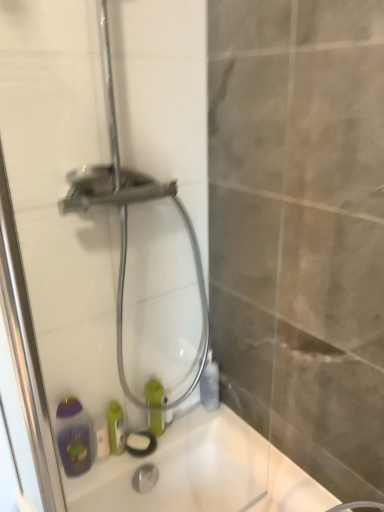
Where is `white matte soap bar at lower left`? The image size is (384, 512). white matte soap bar at lower left is located at coordinates (102, 442).

The image size is (384, 512). What do you see at coordinates (210, 384) in the screenshot?
I see `matte gray bottle at right, the second bottle when ordered from left to right` at bounding box center [210, 384].

At what (x,y) coordinates should I click in order to perform the action: click on white matte soap bar at lower left. Please return your answer as a coordinate pair (x, y). Image resolution: width=384 pixels, height=512 pixels. Looking at the image, I should click on (x=102, y=442).

Could you tell me if white matte soap bar at lower left is facing matte gray bottle at right, the first bottle viewed from the right?

No.

You are a GUI agent. You are given a task and a screenshot of the screen. Output one action in this format:
    pyautogui.click(x=<x>, y=<y>)
    Task: Click on the toiletry located on the left of matte gray bottle at right, the second bottle when ordered from left to right
    This screenshot has width=384, height=512.
    Given the screenshot: What is the action you would take?
    pyautogui.click(x=102, y=442)

From their relative heights in the image, would you say white matte soap bar at lower left is taller or shorter than matte gray bottle at right, the first bottle viewed from the right?

Considering their sizes, white matte soap bar at lower left has less height than matte gray bottle at right, the first bottle viewed from the right.

From a real-world perspective, is white matte soap bar at lower left above or below matte gray bottle at right, the second bottle when ordered from left to right?

Clearly, from a real-world perspective, white matte soap bar at lower left is below matte gray bottle at right, the second bottle when ordered from left to right.

In the scene shown: Is green matte bottle at center, which is the second bottle in right-to-left order, wider or thinner than transparent glass shower door at center?

In the image, green matte bottle at center, which is the second bottle in right-to-left order, appears to be wider than transparent glass shower door at center.

From the image's perspective, which is above, green matte bottle at center, placed as the 1th bottle when sorted from left to right, or transparent glass shower door at center?

transparent glass shower door at center is shown above in the image.

Based on their positions, is green matte bottle at center, which is the second bottle in right-to-left order, located to the left or right of transparent glass shower door at center?

From the image, it's evident that green matte bottle at center, which is the second bottle in right-to-left order, is to the left of transparent glass shower door at center.

Is point (163, 416) positioned before point (71, 305)?

That is False.

From a real-world perspective, is white matte soap bar at lower left on white glossy bath at lower left?

Indeed, from a real-world perspective, white matte soap bar at lower left stands above white glossy bath at lower left.

Considering the positions of point (99, 439) and point (151, 495), is point (99, 439) closer or farther from the camera than point (151, 495)?

Point (99, 439) appears to be closer to the viewer than point (151, 495).

Considering the sizes of white matte soap bar at lower left and white glossy bath at lower left in the image, is white matte soap bar at lower left wider or thinner than white glossy bath at lower left?

In the image, white matte soap bar at lower left appears to be more narrow than white glossy bath at lower left.

In terms of size, does white matte soap bar at lower left appear bigger or smaller than white glossy bath at lower left?

white matte soap bar at lower left is smaller than white glossy bath at lower left.

Find the location of a particular element. shower door on the right of white matte soap bar at lower left is located at coordinates (63, 263).

Considering the relative sizes of white matte soap bar at lower left and transparent glass shower door at center in the image provided, is white matte soap bar at lower left smaller than transparent glass shower door at center?

Indeed, white matte soap bar at lower left has a smaller size compared to transparent glass shower door at center.

Is white matte soap bar at lower left shorter than transparent glass shower door at center?

Yes, white matte soap bar at lower left is shorter than transparent glass shower door at center.

Could you measure the distance between green matte bottle at center, placed as the 1th bottle when sorted from left to right, and matte gray bottle at right, the first bottle viewed from the right?

They are 7.42 inches apart.

Based on the photo, looking at their sizes, would you say green matte bottle at center, which is the second bottle in right-to-left order, is wider or thinner than matte gray bottle at right, the second bottle when ordered from left to right?

Clearly, green matte bottle at center, which is the second bottle in right-to-left order, has less width compared to matte gray bottle at right, the second bottle when ordered from left to right.

Is green matte bottle at center, placed as the 1th bottle when sorted from left to right, facing towards matte gray bottle at right, the second bottle when ordered from left to right?

No.

Is green matte bottle at center, placed as the 1th bottle when sorted from left to right, positioned behind matte gray bottle at right, the second bottle when ordered from left to right?

No, it is not.

Identify the location of bath located on the right of green matte bottle at center, placed as the 1th bottle when sorted from left to right. [x=206, y=472].

Looking at this image, which of these two, white glossy bath at lower left or green matte bottle at center, which is the second bottle in right-to-left order, stands shorter?

Answer: green matte bottle at center, which is the second bottle in right-to-left order.

Would you say white glossy bath at lower left is inside or outside green matte bottle at center, which is the second bottle in right-to-left order?

white glossy bath at lower left is located beyond the bounds of green matte bottle at center, which is the second bottle in right-to-left order.

Where is `bath that appears below the green matte bottle at center, placed as the 1th bottle when sorted from left to right (from the image's perspective)`? bath that appears below the green matte bottle at center, placed as the 1th bottle when sorted from left to right (from the image's perspective) is located at coordinates (206, 472).

From the image's perspective, who appears lower, green matte bottle at center, placed as the 1th bottle when sorted from left to right, or white glossy bath at lower left?

white glossy bath at lower left appears lower in the image.

From the picture: From a real-world perspective, who is located lower, green matte bottle at center, placed as the 1th bottle when sorted from left to right, or white glossy bath at lower left?

From a 3D spatial view, white glossy bath at lower left is below.

Which is more distant, (158, 426) or (228, 456)?

The point (158, 426) is more distant.

From the image's perspective, which bottle is the 2nd one above the white matte soap bar at lower left? Please provide its 2D coordinates.

[(210, 384)]

Identify the location of shower door that is in front of the green matte bottle at center, which is the second bottle in right-to-left order. The height and width of the screenshot is (512, 384). (63, 263).

Based on the photo, based on their spatial positions, is white matte soap bar at lower left or green matte bottle at center, which is the second bottle in right-to-left order, further from transparent glass shower door at center?

The object further to transparent glass shower door at center is white matte soap bar at lower left.

Estimate the real-world distances between objects in this image. Which object is closer to transparent glass shower door at center, green matte bottle at center, which is the second bottle in right-to-left order, or white glossy bath at lower left?

white glossy bath at lower left lies closer to transparent glass shower door at center than the other object.

Looking at this image, from the image, which object appears to be nearer to transparent glass shower door at center, green matte bottle at center, placed as the 1th bottle when sorted from left to right, or white matte soap bar at lower left?

The object closer to transparent glass shower door at center is green matte bottle at center, placed as the 1th bottle when sorted from left to right.

When comparing their distances from white glossy bath at lower left, does matte gray bottle at right, the second bottle when ordered from left to right, or green matte bottle at center, placed as the 1th bottle when sorted from left to right, seem further?

matte gray bottle at right, the second bottle when ordered from left to right.

Looking at the image, which one is located closer to matte gray bottle at right, the second bottle when ordered from left to right, white matte soap bar at lower left or transparent glass shower door at center?

The object closer to matte gray bottle at right, the second bottle when ordered from left to right, is white matte soap bar at lower left.

When comparing their distances from white glossy bath at lower left, does white matte soap bar at lower left or transparent glass shower door at center seem closer?

white matte soap bar at lower left.

When comparing their distances from white glossy bath at lower left, does white matte soap bar at lower left or matte gray bottle at right, the second bottle when ordered from left to right, seem further?

white matte soap bar at lower left is positioned further to the anchor white glossy bath at lower left.

Which object lies nearer to the anchor point white matte soap bar at lower left, green matte bottle at center, placed as the 1th bottle when sorted from left to right, or matte gray bottle at right, the first bottle viewed from the right?

Based on the image, green matte bottle at center, placed as the 1th bottle when sorted from left to right, appears to be nearer to white matte soap bar at lower left.

This screenshot has height=512, width=384. I want to click on bottle between transparent glass shower door at center and matte gray bottle at right, the first bottle viewed from the right, along the z-axis, so click(x=153, y=393).

At what (x,y) coordinates should I click in order to perform the action: click on toiletry positioned between white glossy bath at lower left and matte gray bottle at right, the second bottle when ordered from left to right, from near to far. Please return your answer as a coordinate pair (x, y). The height and width of the screenshot is (512, 384). Looking at the image, I should click on (102, 442).

Locate an element on the screen. The width and height of the screenshot is (384, 512). bath between transparent glass shower door at center and matte gray bottle at right, the first bottle viewed from the right, in the front-back direction is located at coordinates (206, 472).

Identify the location of toiletry between transparent glass shower door at center and matte gray bottle at right, the first bottle viewed from the right, in the front-back direction. The height and width of the screenshot is (512, 384). (102, 442).